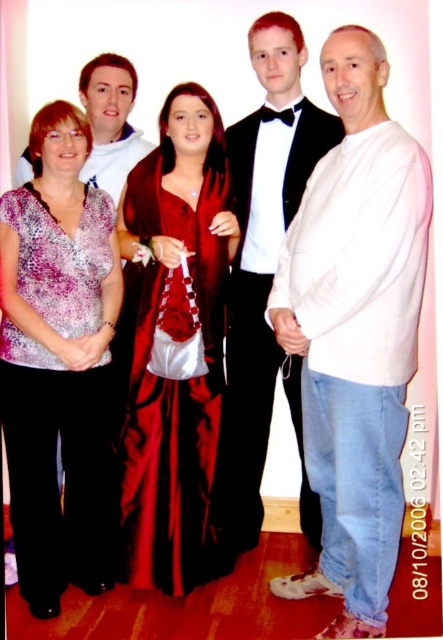
You are a photographer adjusting your camera settings to focus on the subjects. Which of the two, the satin dress at center or the matte white tuxedo at upper center, is positioned closer to the camera?

The satin dress at center is closer to the viewer than the matte white tuxedo at upper center, so the satin dress at center is positioned closer to the camera.

You are a photographer trying to decide which of the two white garments, the white cotton shirt at right or the matte white tuxedo at upper center, will appear more slender in the photo. Based on their actual sizes, which one should you expect to look thinner?

The white cotton shirt at right is thinner than the matte white tuxedo at upper center, so it will appear more slender in the photo.